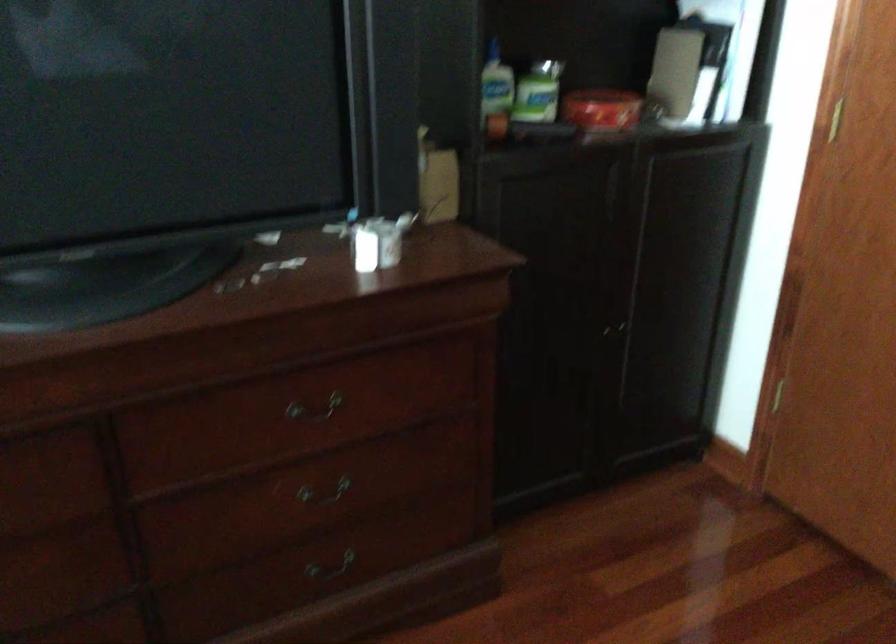
Locate an element on the screen. The image size is (896, 644). red circular tin is located at coordinates (600, 109).